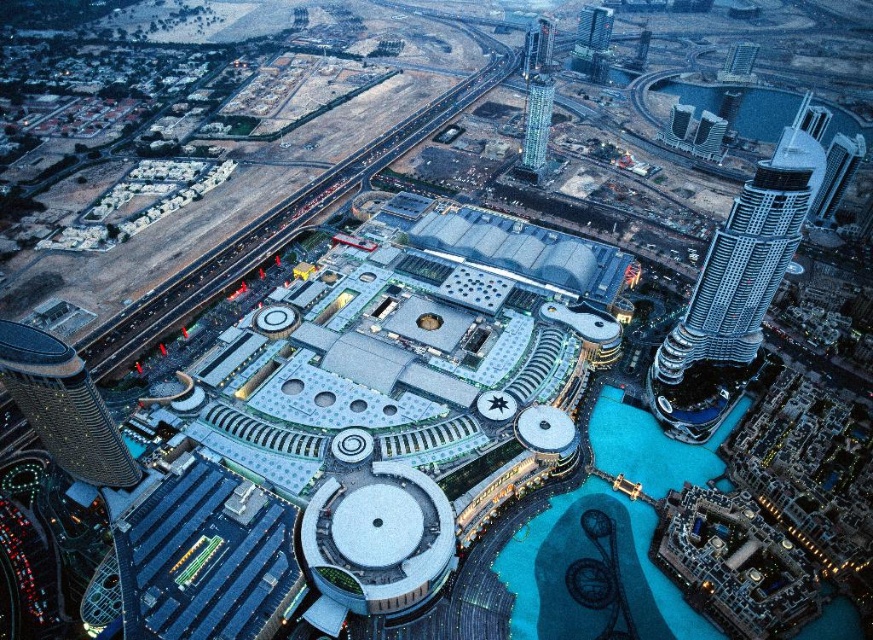
What is the 2D coordinate of the silver metallic skyscraper at right in the image?

The 2D coordinate of the silver metallic skyscraper at right is at point (741, 273).

You are a drone operator tasked with flying a drone between the silver metallic skyscraper at right and the glassy skyscraper at upper center. The drone has a maximum flight distance of 150 meters. Can the drone safely complete this flight without exceeding its range?

The distance between the silver metallic skyscraper at right and the glassy skyscraper at upper center is 140.43 meters, which is within the drone operator s 150 meter range. The drone can safely complete the flight between them.

Consider the image. You are a drone operator trying to navigate between the silver metallic skyscraper at right and the glassy skyscraper at upper center. Which skyscraper is located to the right of the other?

The silver metallic skyscraper at right is positioned on the right side of the glassy skyscraper at upper center, so the silver metallic skyscraper at right is to the right of the glassy skyscraper at upper center.